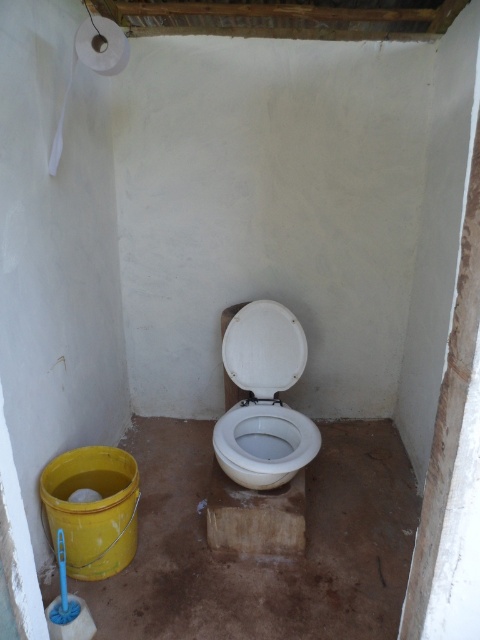
Does white glossy toilet bowl at center have a smaller size compared to white matte toilet paper at upper left?

Incorrect, white glossy toilet bowl at center is not smaller in size than white matte toilet paper at upper left.

Based on the photo, which is more to the left, white glossy toilet bowl at center or white matte toilet paper at upper left?

white matte toilet paper at upper left

The height and width of the screenshot is (640, 480). What are the coordinates of `white glossy toilet bowl at center` in the screenshot? It's located at (264, 444).